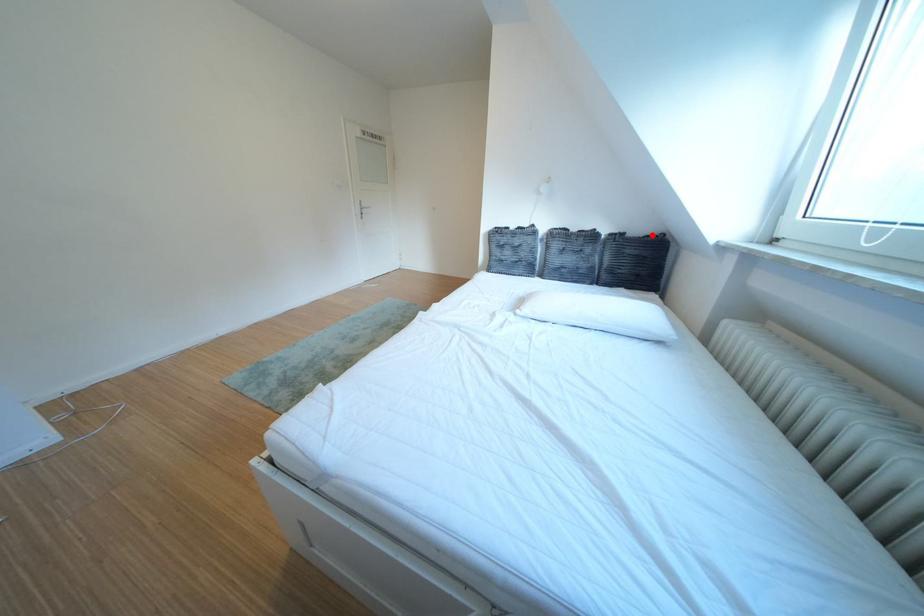
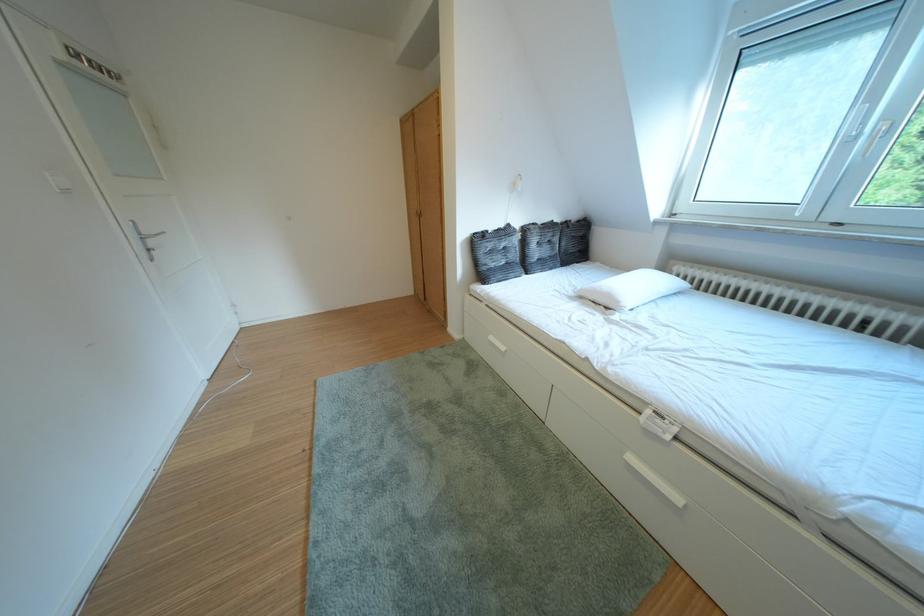
Question: I am providing you with two images of the same scene from different viewpoints. Given a red point in image1, look at the same physical point in image2. Is it:

Choices:
 (A) Closer to the viewpoint
 (B) Farther from the viewpoint

Answer: (A)